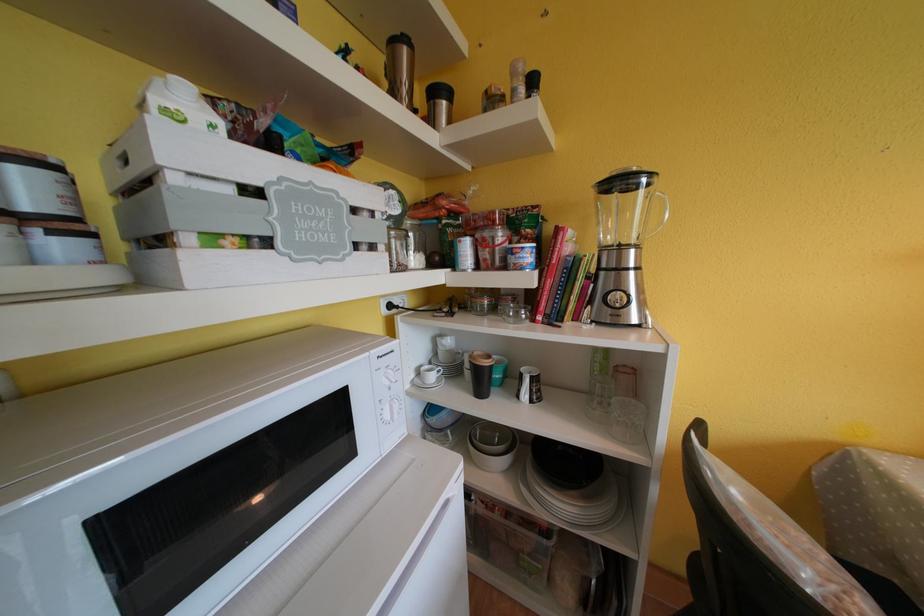
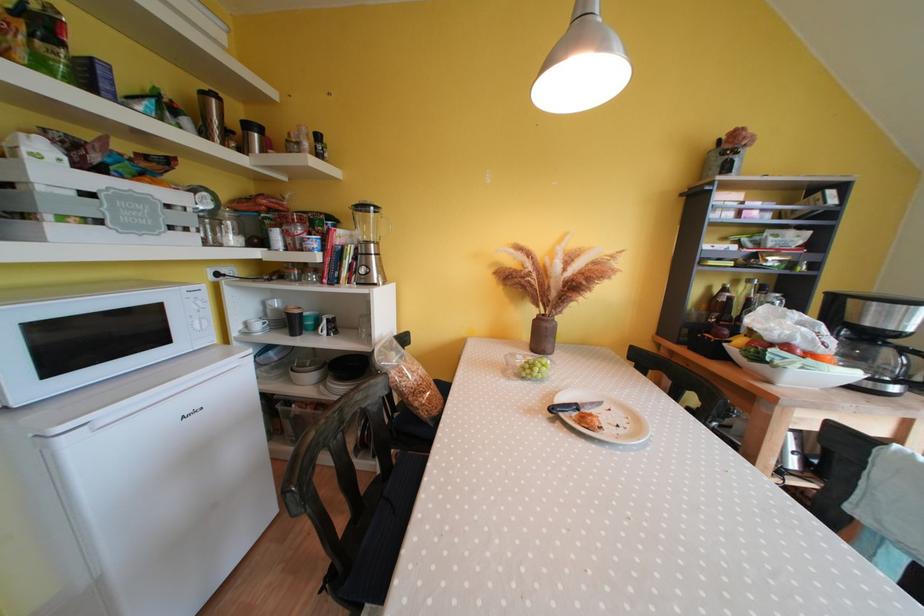
The point at [440,95] is marked in the first image. Where is the corresponding point in the second image?

(252, 130)